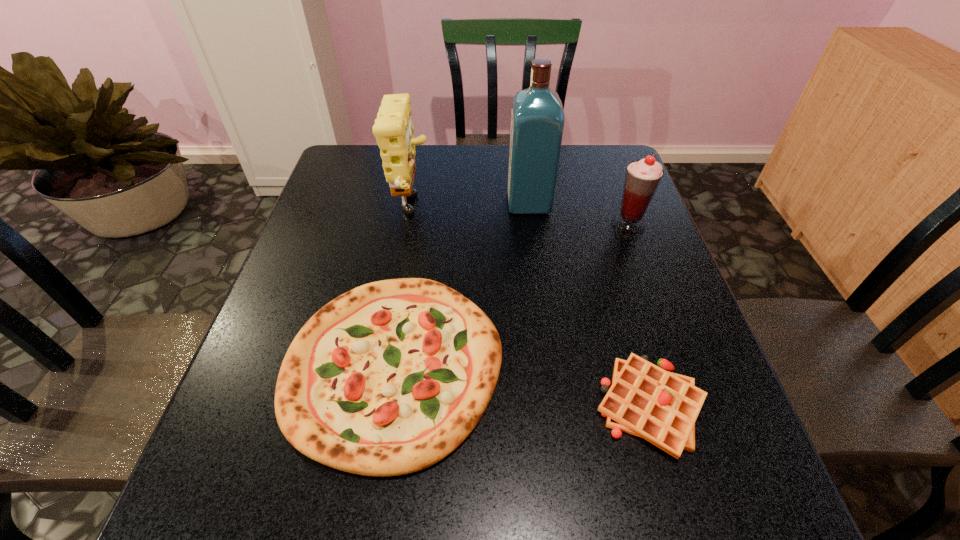
Where is `free space that satisfies the following two spatial constraints: 1. on the face of the fourth shortest object; 2. on the left side of the smoothie`? The width and height of the screenshot is (960, 540). free space that satisfies the following two spatial constraints: 1. on the face of the fourth shortest object; 2. on the left side of the smoothie is located at coordinates (409, 226).

Where is `vacant region that satisfies the following two spatial constraints: 1. on the face of the sponge; 2. on the right side of the waffle`? The height and width of the screenshot is (540, 960). vacant region that satisfies the following two spatial constraints: 1. on the face of the sponge; 2. on the right side of the waffle is located at coordinates (378, 407).

Locate an element on the screen. The image size is (960, 540). free space that satisfies the following two spatial constraints: 1. on the face of the pizza; 2. on the left side of the fourth shortest object is located at coordinates (385, 364).

Image resolution: width=960 pixels, height=540 pixels. Find the location of `vacant space that satisfies the following two spatial constraints: 1. on the face of the sponge; 2. on the left side of the pizza`. vacant space that satisfies the following two spatial constraints: 1. on the face of the sponge; 2. on the left side of the pizza is located at coordinates (385, 364).

Image resolution: width=960 pixels, height=540 pixels. I want to click on free space that satisfies the following two spatial constraints: 1. on the flat label side of the smoothie; 2. on the left side of the third object from left to right, so click(x=532, y=226).

Identify the location of vacant space that satisfies the following two spatial constraints: 1. on the face of the sponge; 2. on the back side of the waffle. The height and width of the screenshot is (540, 960). (378, 407).

The image size is (960, 540). Identify the location of free location that satisfies the following two spatial constraints: 1. on the flat label side of the tallest object; 2. on the right side of the smoothie. (532, 226).